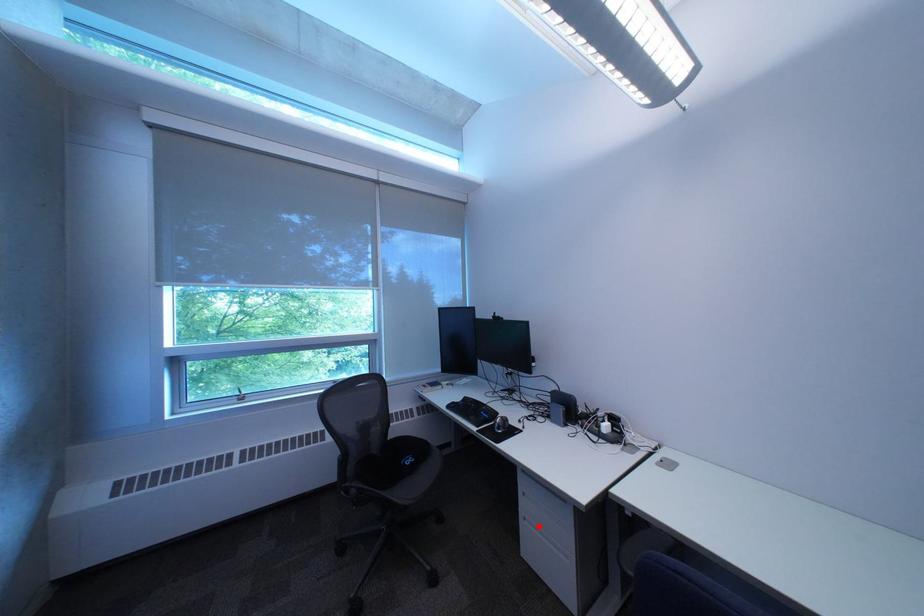
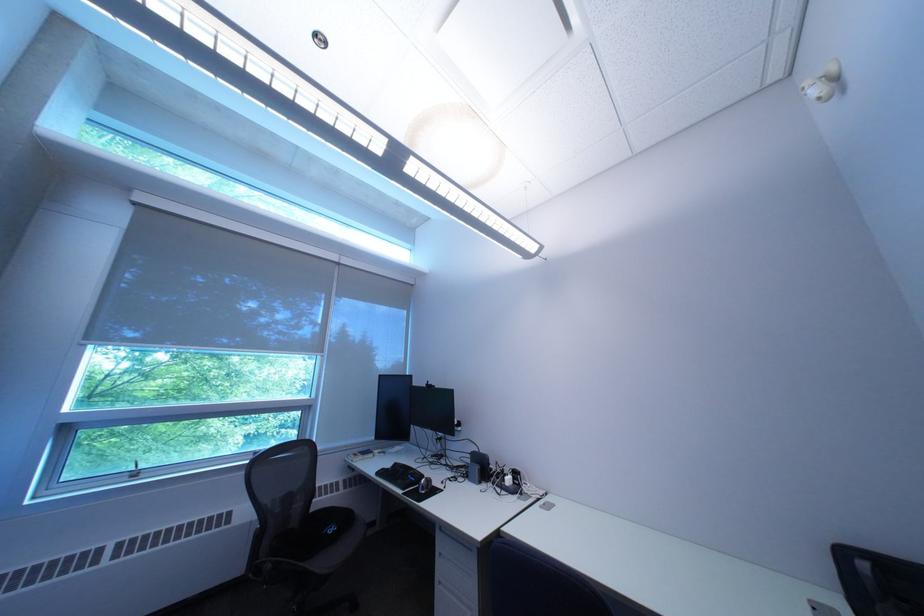
Question: I am providing you with two images of the same scene from different viewpoints. In image1, a red point is highlighted. Considering the same 3D point in image2, which of the following is correct?

Choices:
 (A) It is closer
 (B) It is farther

Answer: (A)